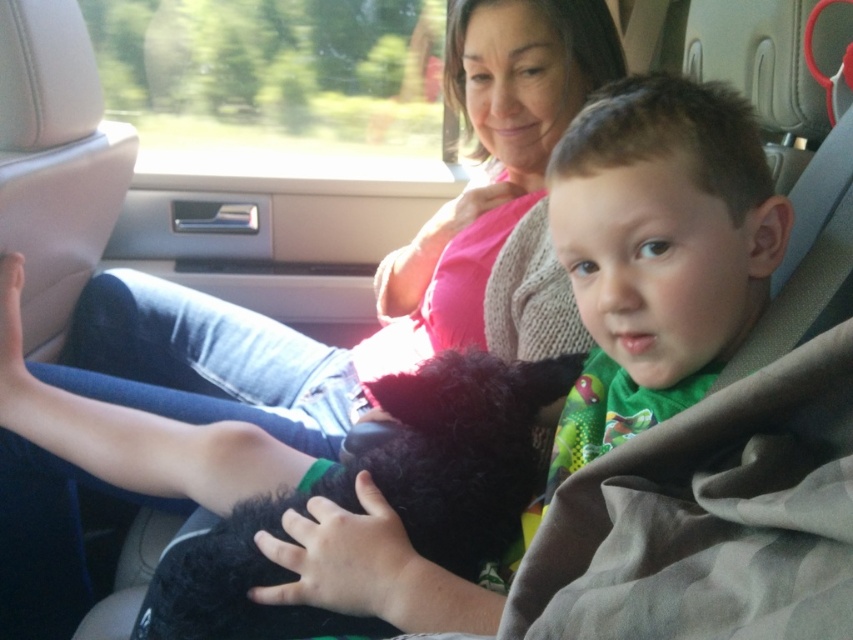
Question: Which point is farther from the camera taking this photo?

Choices:
 (A) (570, 472)
 (B) (460, 547)

Answer: (A)

Question: Can you confirm if green jersey at center is positioned below black fuzzy dog at center?

Choices:
 (A) yes
 (B) no

Answer: (B)

Question: Can you confirm if green jersey at center is wider than black fuzzy dog at center?

Choices:
 (A) yes
 (B) no

Answer: (B)

Question: Which point is closer to the camera taking this photo?

Choices:
 (A) (567, 179)
 (B) (437, 385)

Answer: (A)

Question: Does green jersey at center have a smaller size compared to black fuzzy dog at center?

Choices:
 (A) no
 (B) yes

Answer: (B)